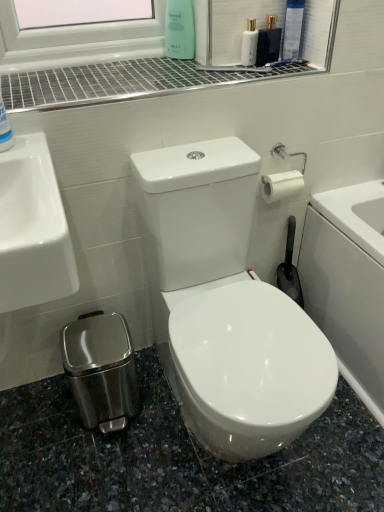
Locate an element on the screen. free point above metallic grid at upper center (from a real-world perspective) is located at coordinates (144, 71).